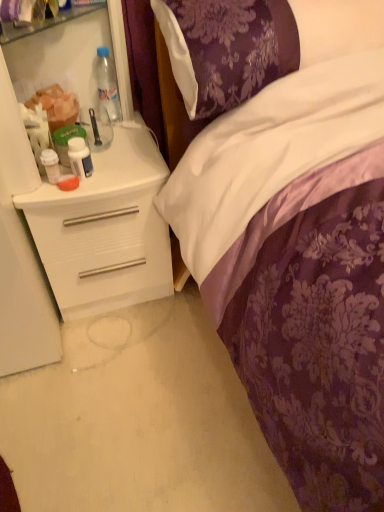
Image resolution: width=384 pixels, height=512 pixels. I want to click on empty space that is in between clear plastic bottle at upper left, which is counted as the first bottle, starting from the top, and translucent plastic cup at left, so click(98, 129).